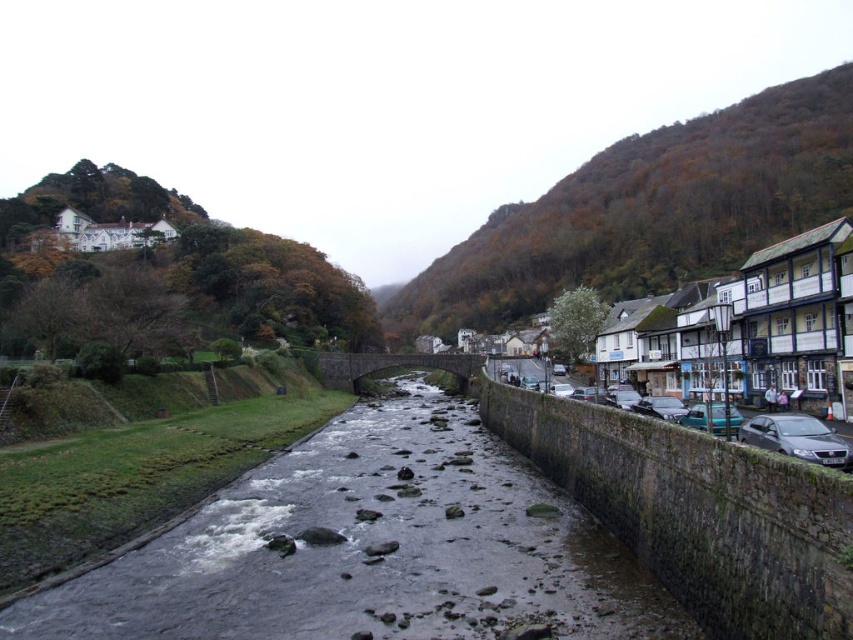
Does smooth concrete river at center have a smaller size compared to white wooden house at upper left?

Correct, smooth concrete river at center occupies less space than white wooden house at upper left.

You are a GUI agent. You are given a task and a screenshot of the screen. Output one action in this format:
    pyautogui.click(x=<x>, y=<y>)
    Task: Click on the smooth concrete river at center
    This screenshot has height=640, width=853.
    Given the screenshot: What is the action you would take?
    pyautogui.click(x=370, y=548)

Identify the location of smooth concrete river at center. (370, 548).

Does point (225, 627) lie behind point (546, 225)?

No, (225, 627) is closer to viewer.

Does smooth concrete river at center have a greater height compared to green leafy hillside at upper right?

No.

Describe the element at coordinates (370, 548) in the screenshot. The image size is (853, 640). I see `smooth concrete river at center` at that location.

The height and width of the screenshot is (640, 853). I want to click on smooth concrete river at center, so click(370, 548).

Between green leafy hillside at upper right and metallic gray car at right, which one is positioned higher?

green leafy hillside at upper right is higher up.

Which is behind, point (776, 192) or point (793, 442)?

Point (776, 192)

Identify the location of green leafy hillside at upper right. (648, 211).